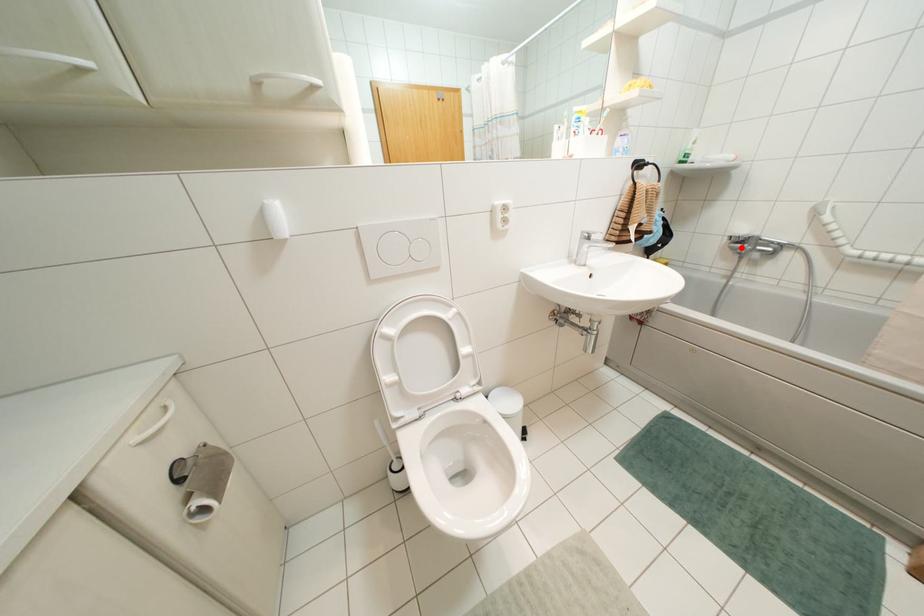
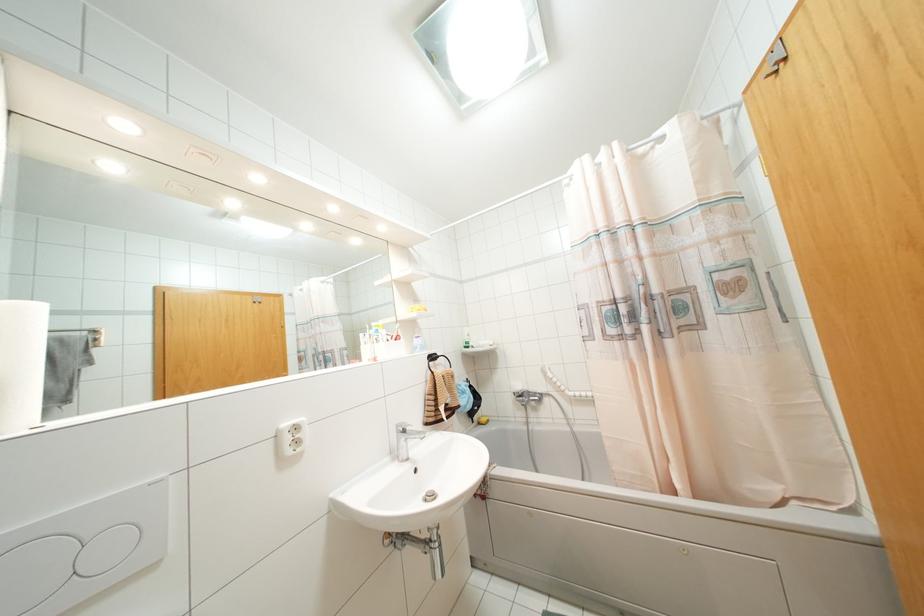
Find the pixel in the second image that matches the highlighted location in the first image.

(523, 400)